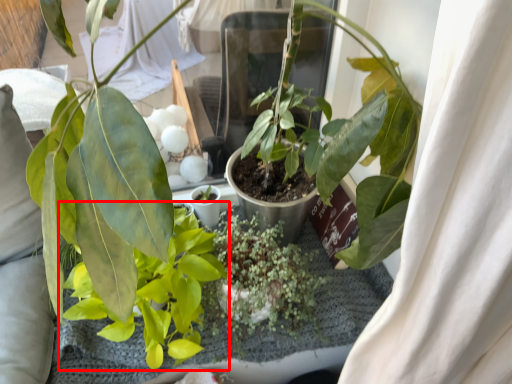
Question: Where is houseplant (annotated by the red box) located in relation to houseplant in the image?

Choices:
 (A) right
 (B) left

Answer: (B)